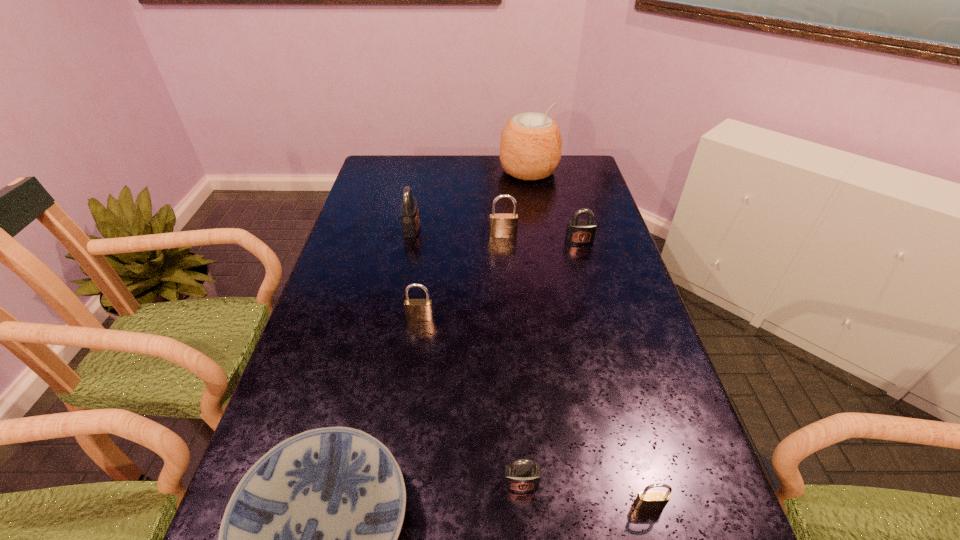
This screenshot has height=540, width=960. I want to click on vacant region between the tallest object and the leftmost padlock, so click(x=470, y=200).

Identify the location of vacant space in between the second brass padlock from left to right and the rightmost brass padlock. The image size is (960, 540). (576, 370).

Locate an element on the screen. free spot between the leftmost gray padlock and the fifth farthest object is located at coordinates (416, 273).

Select which object appears as the sixth closest to the leftmost padlock. Please provide its 2D coordinates. Your answer should be formatted as a tuple, i.e. [(x, y)], where the tuple contains the x and y coordinates of a point satisfying the conditions above.

[(522, 475)]

Identify the location of object that ranks as the closest to the nearest padlock. This screenshot has width=960, height=540. (522, 475).

Select which padlock appears as the second closest to the fourth nearest object. Please provide its 2D coordinates. Your answer should be formatted as a tuple, i.e. [(x, y)], where the tuple contains the x and y coordinates of a point satisfying the conditions above.

[(501, 225)]

Locate an element on the screen. The image size is (960, 540). padlock that stands as the closest to the second biggest gray padlock is located at coordinates (501, 225).

Identify the location of gray padlock that stands as the second closest to the leftmost padlock. The image size is (960, 540). (522, 475).

Where is `gray padlock identified as the closest to the farthest object`? gray padlock identified as the closest to the farthest object is located at coordinates (579, 232).

The height and width of the screenshot is (540, 960). Find the location of `brass padlock object that ranks as the closest to the biggest brass padlock`. brass padlock object that ranks as the closest to the biggest brass padlock is located at coordinates (415, 309).